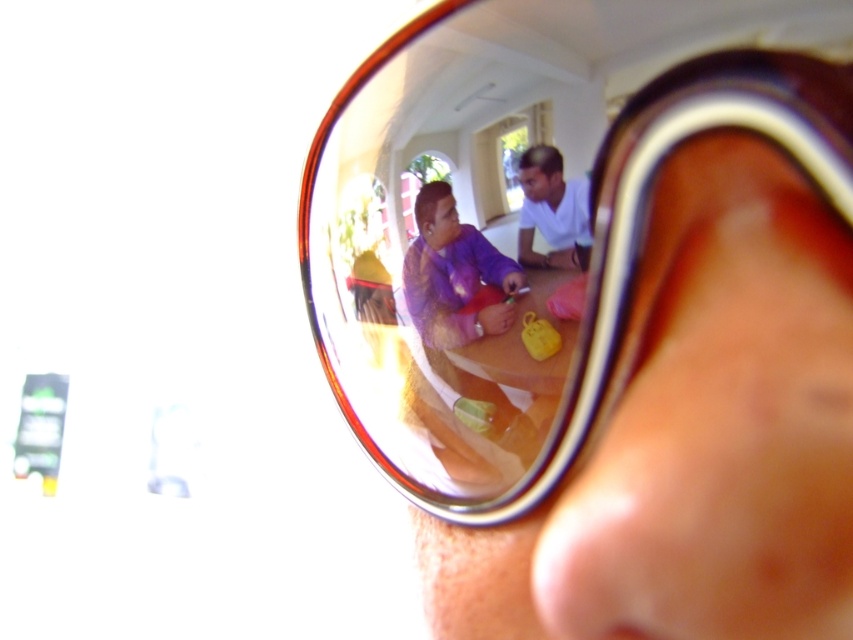
Question: Is shiny brown goggles at center further to the viewer compared to purple fabric shirt at center?

Choices:
 (A) yes
 (B) no

Answer: (B)

Question: Which point is farther to the camera?

Choices:
 (A) [817, 90]
 (B) [561, 236]
 (C) [448, 241]

Answer: (C)

Question: Which of the following is the closest to the observer?

Choices:
 (A) white matte shirt at center
 (B) purple fabric shirt at center
 (C) shiny brown goggles at center

Answer: (C)

Question: Among these points, which one is nearest to the camera?

Choices:
 (A) (300, 186)
 (B) (521, 170)

Answer: (B)

Question: Can you confirm if shiny brown goggles at center is thinner than white matte shirt at center?

Choices:
 (A) no
 (B) yes

Answer: (A)

Question: Does shiny brown goggles at center appear on the right side of purple fabric shirt at center?

Choices:
 (A) yes
 (B) no

Answer: (A)